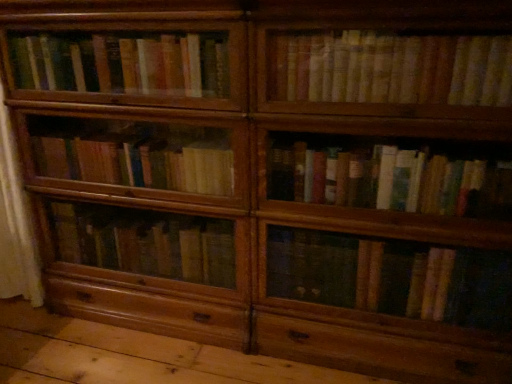
The width and height of the screenshot is (512, 384). Find the location of `light brown leather book at upper right`. light brown leather book at upper right is located at coordinates (391, 68).

The height and width of the screenshot is (384, 512). What do you see at coordinates (391, 68) in the screenshot?
I see `light brown leather book at upper right` at bounding box center [391, 68].

Find the location of a particular element. The height and width of the screenshot is (384, 512). light brown leather book at upper right is located at coordinates (391, 68).